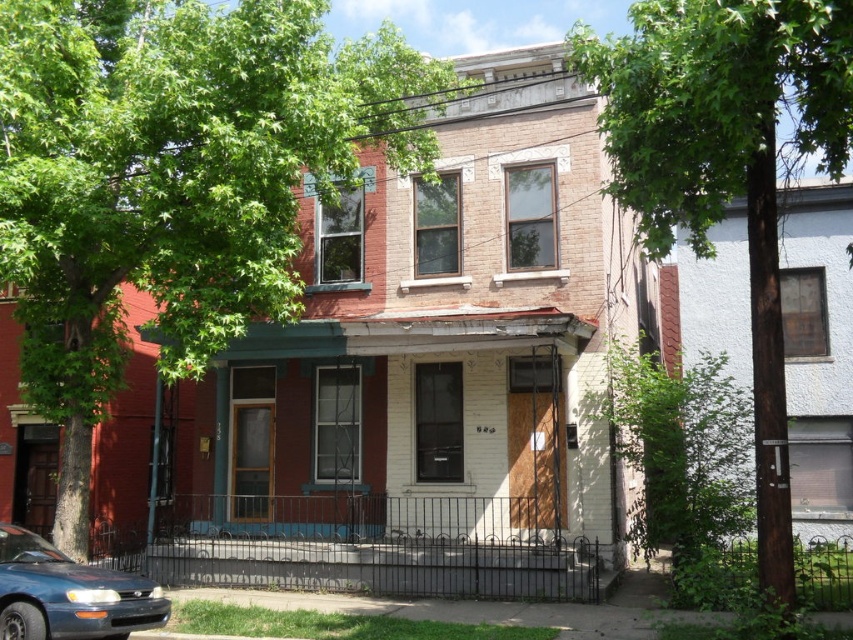
You are a delivery person trying to park your van next to the matte blue sedan at lower left. The green leafy tree at center has a trunk that extends down to the ground. Will the tree interfere with parking your van there?

The green leafy tree at center is located above the matte blue sedan at lower left, meaning the tree is positioned higher up and not directly blocking the area where the matte blue sedan at lower left is parked. Therefore, the tree should not interfere with parking your van next to the matte blue sedan at lower left.